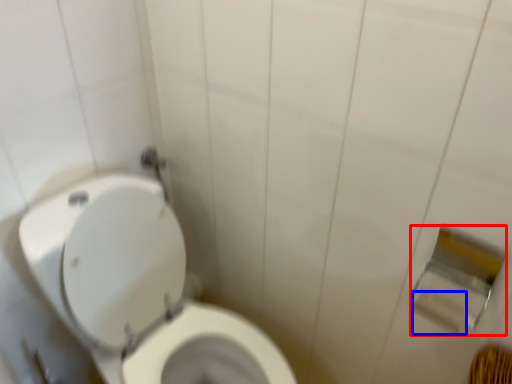
Question: Which of the following is the farthest to the observer, toilet paper (highlighted by a red box) or toilet paper (highlighted by a blue box)?

Choices:
 (A) toilet paper
 (B) toilet paper

Answer: (B)